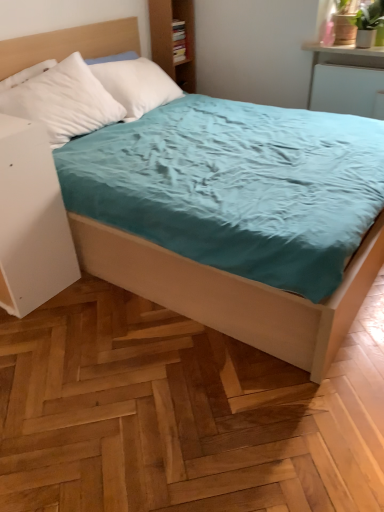
Image resolution: width=384 pixels, height=512 pixels. What do you see at coordinates (31, 220) in the screenshot?
I see `white matte nightstand at left` at bounding box center [31, 220].

I want to click on white matte nightstand at left, so click(31, 220).

Based on the photo, what is the approximate height of white matte nightstand at left?

It is 32.03 inches.

Image resolution: width=384 pixels, height=512 pixels. Describe the element at coordinates (343, 49) in the screenshot. I see `white glossy shelf at upper right` at that location.

At what (x,y) coordinates should I click in order to perform the action: click on white glossy shelf at upper right. Please return your answer as a coordinate pair (x, y). The image size is (384, 512). Looking at the image, I should click on (343, 49).

Find the location of a particular element. The height and width of the screenshot is (512, 384). white matte nightstand at left is located at coordinates (31, 220).

Which is more to the left, white matte nightstand at left or white glossy shelf at upper right?

white matte nightstand at left.

Which object is closer to the camera, white matte nightstand at left or white glossy shelf at upper right?

white matte nightstand at left is in front.

Is point (5, 294) closer or farther from the camera than point (327, 46)?

Point (5, 294).

From the image's perspective, is white matte nightstand at left below white glossy shelf at upper right?

Indeed, from the image's perspective, white matte nightstand at left is shown beneath white glossy shelf at upper right.

From a real-world perspective, is white matte nightstand at left beneath white glossy shelf at upper right?

Yes.

Which of these two, white matte nightstand at left or white glossy shelf at upper right, is wider?

Wider between the two is white glossy shelf at upper right.

Considering the sizes of white matte nightstand at left and white glossy shelf at upper right in the image, is white matte nightstand at left taller or shorter than white glossy shelf at upper right?

Considering their sizes, white matte nightstand at left has more height than white glossy shelf at upper right.

Considering the sizes of objects white matte nightstand at left and white glossy shelf at upper right in the image provided, who is bigger, white matte nightstand at left or white glossy shelf at upper right?

With larger size is white matte nightstand at left.

Is white matte nightstand at left not inside white glossy shelf at upper right?

Yes, white matte nightstand at left is outside of white glossy shelf at upper right.

Is white matte nightstand at left beside white glossy shelf at upper right?

white matte nightstand at left is not next to white glossy shelf at upper right, and they're not touching.

Does white matte nightstand at left turn towards white glossy shelf at upper right?

No, white matte nightstand at left is not turned towards white glossy shelf at upper right.

How many degrees apart are the facing directions of white matte nightstand at left and white glossy shelf at upper right?

The angular difference between white matte nightstand at left and white glossy shelf at upper right is 0.117 degrees.

Identify the location of window sill above the white matte nightstand at left (from a real-world perspective). The height and width of the screenshot is (512, 384). (343, 49).

Does white glossy shelf at upper right appear on the left side of white matte nightstand at left?

No, white glossy shelf at upper right is not to the left of white matte nightstand at left.

Which object is closer to the camera, white glossy shelf at upper right or white matte nightstand at left?

white matte nightstand at left is more forward.

Which point is more forward, (366, 51) or (14, 221)?

Positioned in front is point (14, 221).

From the image's perspective, between white glossy shelf at upper right and white matte nightstand at left, which one is located above?

white glossy shelf at upper right, from the image's perspective.

From a real-world perspective, who is located higher, white glossy shelf at upper right or white matte nightstand at left?

white glossy shelf at upper right is physically above.

Can you confirm if white glossy shelf at upper right is thinner than white matte nightstand at left?

No.

Does white glossy shelf at upper right have a lesser height compared to white matte nightstand at left?

→ Correct, white glossy shelf at upper right is not as tall as white matte nightstand at left.

Does white glossy shelf at upper right have a smaller size compared to white matte nightstand at left?

Yes.

Is white glossy shelf at upper right located outside white matte nightstand at left?

Yes.

Is white glossy shelf at upper right beside white matte nightstand at left?

white glossy shelf at upper right and white matte nightstand at left are clearly separated.

Could you tell me if white glossy shelf at upper right is turned towards white matte nightstand at left?

No.

How different are the orientations of white glossy shelf at upper right and white matte nightstand at left in degrees?

white glossy shelf at upper right and white matte nightstand at left are facing 0.117 degrees away from each other.

The height and width of the screenshot is (512, 384). I want to click on window sill located behind the white matte nightstand at left, so click(343, 49).

This screenshot has width=384, height=512. I want to click on nightstand below the white glossy shelf at upper right (from a real-world perspective), so click(31, 220).

The image size is (384, 512). I want to click on nightstand located in front of the white glossy shelf at upper right, so click(x=31, y=220).